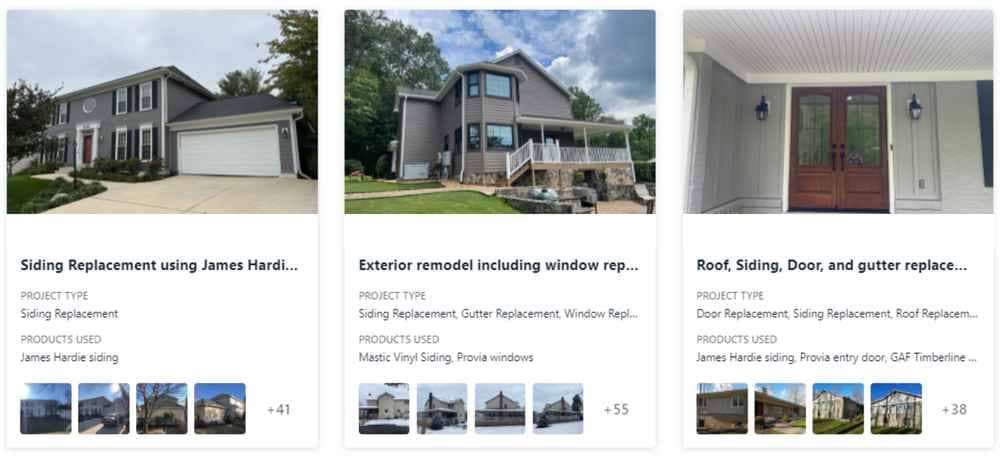
This screenshot has width=1001, height=458. I want to click on windows, so click(x=121, y=106), click(x=146, y=101), click(x=145, y=149), click(x=125, y=148), click(x=468, y=93), click(x=491, y=85), click(x=492, y=135), click(x=472, y=139), click(x=866, y=133), click(x=814, y=133).